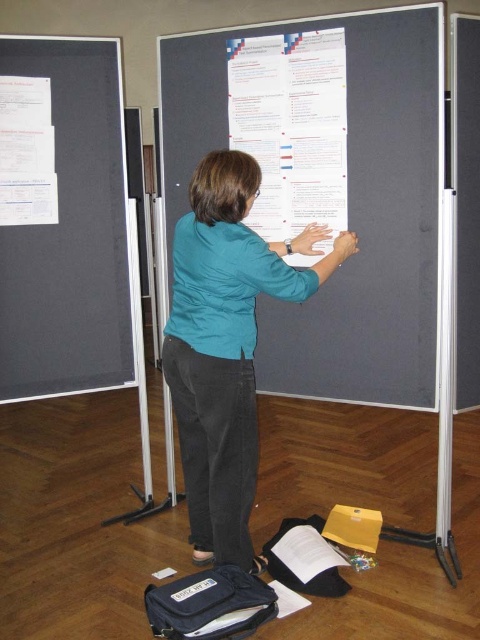
You are standing in a room where a person is interacting with a poster board. You notice a point marked at coordinates (334,202). What object is located at this point?

The point at coordinates (334,202) marks the matte gray poster at center.